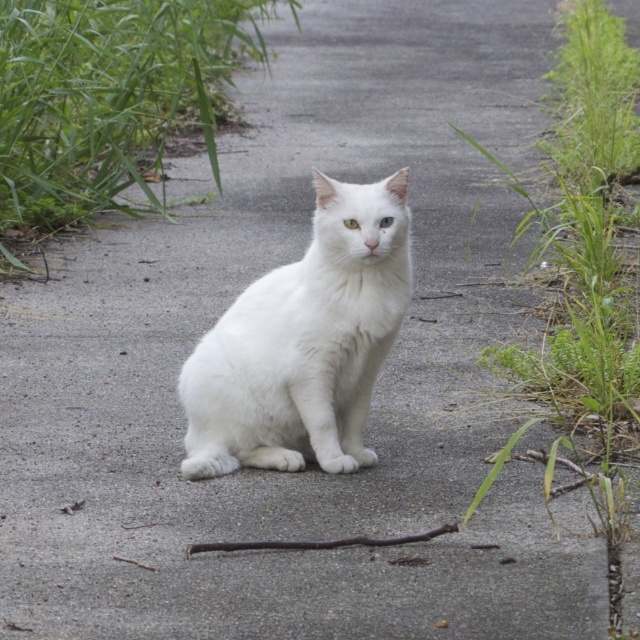
Is green leafy grass at upper left bigger than white fluffy cat at center?

Correct, green leafy grass at upper left is larger in size than white fluffy cat at center.

Find the location of a particular element. The height and width of the screenshot is (640, 640). green leafy grass at upper left is located at coordinates (108, 99).

In the scene shown: Is white fluffy cat at center smaller than green leafy grass at upper right?

Indeed, white fluffy cat at center has a smaller size compared to green leafy grass at upper right.

Find the location of a particular element. white fluffy cat at center is located at coordinates pos(305,342).

Does point (316, 378) lie behind point (556, 385)?

No, (316, 378) is closer to viewer.

I want to click on white fluffy cat at center, so click(305, 342).

Where is `green leafy grass at upper left`? The width and height of the screenshot is (640, 640). green leafy grass at upper left is located at coordinates (108, 99).

Between green leafy grass at upper left and green leafy grass at upper right, which one has less height?

green leafy grass at upper left is shorter.

Who is more forward, (84, 3) or (612, 360)?

Point (612, 360) is more forward.

Where is `green leafy grass at upper left`? green leafy grass at upper left is located at coordinates (108, 99).